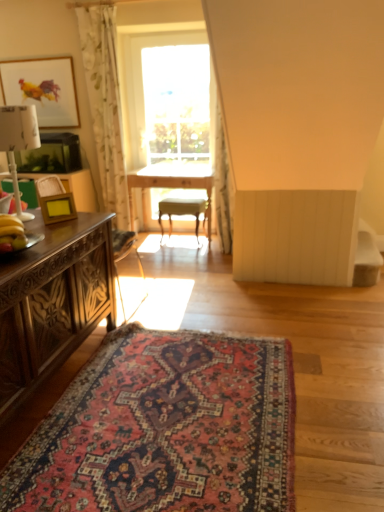
Question: Should I look upward or downward to see white fabric lampshade at left?

Choices:
 (A) up
 (B) down

Answer: (A)

Question: Could you tell me if wooden table at center is turned towards white floral fabric curtain at upper center, positioned as the first curtain in right-to-left order?

Choices:
 (A) no
 (B) yes

Answer: (A)

Question: Are wooden table at center and white floral fabric curtain at upper center, positioned as the first curtain in right-to-left order, located far from each other?

Choices:
 (A) no
 (B) yes

Answer: (A)

Question: From the image's perspective, is wooden table at center located above white floral fabric curtain at upper center, positioned as the first curtain in right-to-left order?

Choices:
 (A) yes
 (B) no

Answer: (B)

Question: Does wooden table at center have a lesser height compared to white floral fabric curtain at upper center, positioned as the first curtain in right-to-left order?

Choices:
 (A) yes
 (B) no

Answer: (A)

Question: From the image's perspective, would you say wooden table at center is shown under white floral fabric curtain at upper center, marked as the second curtain in a left-to-right arrangement?

Choices:
 (A) yes
 (B) no

Answer: (A)

Question: Is white floral fabric curtain at upper center, marked as the second curtain in a left-to-right arrangement, surrounded by wooden table at center?

Choices:
 (A) no
 (B) yes

Answer: (A)

Question: From a real-world perspective, is translucent floral fabric at left, the 1th curtain viewed from the left, over wooden photo frame at left, the second picture frame when ordered from left to right?

Choices:
 (A) yes
 (B) no

Answer: (A)

Question: Can you confirm if translucent floral fabric at left, the 2th curtain when ordered from right to left, is taller than wooden photo frame at left, which is the 1th picture frame from front to back?

Choices:
 (A) yes
 (B) no

Answer: (A)

Question: Is translucent floral fabric at left, the 2th curtain when ordered from right to left, shorter than wooden photo frame at left, which is the 1th picture frame from front to back?

Choices:
 (A) no
 (B) yes

Answer: (A)

Question: Is wooden photo frame at left, the second picture frame viewed from the top, a part of translucent floral fabric at left, the 1th curtain viewed from the left?

Choices:
 (A) yes
 (B) no

Answer: (B)

Question: Can you confirm if translucent floral fabric at left, the 2th curtain when ordered from right to left, is thinner than wooden photo frame at left, which is the 1th picture frame from front to back?

Choices:
 (A) yes
 (B) no

Answer: (B)

Question: Could you tell me if translucent floral fabric at left, the 2th curtain when ordered from right to left, is facing wooden photo frame at left, which is the 1th picture frame from front to back?

Choices:
 (A) yes
 (B) no

Answer: (B)

Question: Does yellow matte banana at left turn towards matte wooden picture frame at upper left, the 1th picture frame in the top-to-bottom sequence?

Choices:
 (A) yes
 (B) no

Answer: (B)